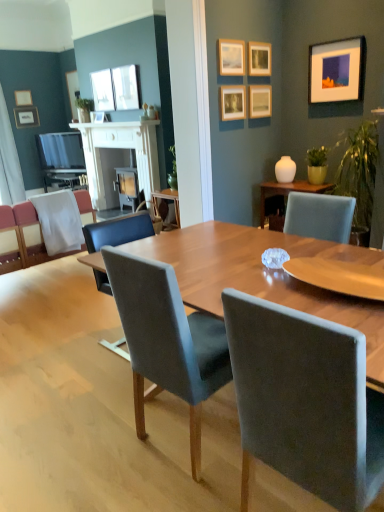
Question: Is white glossy vase at upper right at the back of white fabric curtain at left?

Choices:
 (A) no
 (B) yes

Answer: (A)

Question: Considering the relative sizes of white fabric curtain at left and white glossy vase at upper right in the image provided, is white fabric curtain at left bigger than white glossy vase at upper right?

Choices:
 (A) no
 (B) yes

Answer: (B)

Question: From the image's perspective, is white fabric curtain at left below white glossy vase at upper right?

Choices:
 (A) yes
 (B) no

Answer: (B)

Question: Is white fabric curtain at left closer to camera compared to white glossy vase at upper right?

Choices:
 (A) no
 (B) yes

Answer: (A)

Question: Considering the relative sizes of white fabric curtain at left and white glossy vase at upper right in the image provided, is white fabric curtain at left thinner than white glossy vase at upper right?

Choices:
 (A) yes
 (B) no

Answer: (B)

Question: In the image, is matte gold picture frame at upper left, which appears as the 1th picture frame when viewed from the left, on the left side or the right side of matte wooden picture frame at upper center, the 3th picture frame in the front-to-back sequence?

Choices:
 (A) right
 (B) left

Answer: (B)

Question: Does point (19, 102) appear closer or farther from the camera than point (228, 94)?

Choices:
 (A) farther
 (B) closer

Answer: (A)

Question: In terms of height, does matte gold picture frame at upper left, the tenth picture frame when ordered from right to left, look taller or shorter compared to matte wooden picture frame at upper center, which appears as the 8th picture frame when viewed from the back?

Choices:
 (A) short
 (B) tall

Answer: (A)

Question: From the image's perspective, relative to matte wooden picture frame at upper center, the 3th picture frame in the front-to-back sequence, is matte gold picture frame at upper left, placed as the 8th picture frame when sorted from front to back, above or below?

Choices:
 (A) above
 (B) below

Answer: (A)

Question: From their relative heights in the image, would you say matte wooden picture frame at upper center, which is the 4th picture frame in right-to-left order, is taller or shorter than matte gray chair at center, which is the third chair in left-to-right order?

Choices:
 (A) short
 (B) tall

Answer: (A)

Question: Choose the correct answer: Is matte wooden picture frame at upper center, the 3th picture frame in the front-to-back sequence, inside matte gray chair at center, arranged as the first chair when viewed from the right, or outside it?

Choices:
 (A) inside
 (B) outside

Answer: (B)

Question: From a real-world perspective, is matte wooden picture frame at upper center, acting as the seventh picture frame starting from the left, physically located above or below matte gray chair at center, which is the third chair in left-to-right order?

Choices:
 (A) above
 (B) below

Answer: (A)

Question: Considering their positions, is matte wooden picture frame at upper center, which appears as the 8th picture frame when viewed from the back, located in front of or behind matte gray chair at center, which is the third chair in left-to-right order?

Choices:
 (A) front
 (B) behind

Answer: (B)

Question: Choose the correct answer: Is translucent glass coffee table at center inside white glossy vase at upper right or outside it?

Choices:
 (A) inside
 (B) outside

Answer: (B)

Question: Based on their positions, is translucent glass coffee table at center located to the left or right of white glossy vase at upper right?

Choices:
 (A) left
 (B) right

Answer: (B)